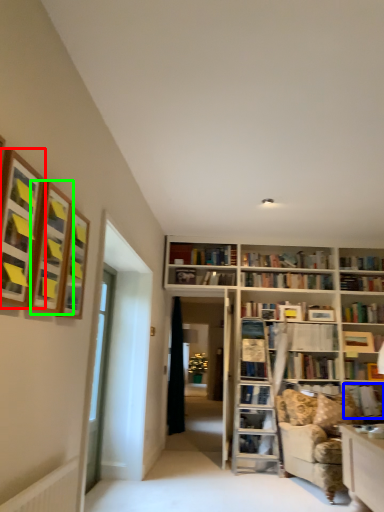
Question: Which object is the farthest from shelf (highlighted by a red box)? Choose among these: book (highlighted by a blue box) or shelf (highlighted by a green box).

Choices:
 (A) book
 (B) shelf

Answer: (A)